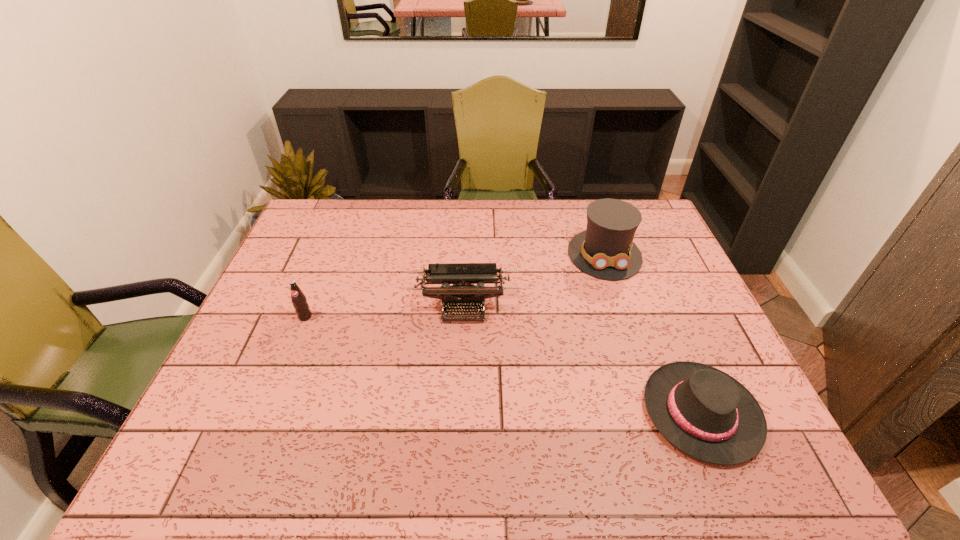
Find the location of `the farther dress hat`. the farther dress hat is located at coordinates (605, 250).

Where is `the tallest object`? This screenshot has width=960, height=540. the tallest object is located at coordinates (605, 250).

At what (x,y) coordinates should I click in order to perform the action: click on the leftmost object. Please return your answer as a coordinate pair (x, y). The height and width of the screenshot is (540, 960). Looking at the image, I should click on click(299, 300).

The width and height of the screenshot is (960, 540). Identify the location of pop. [299, 300].

At what (x,y) coordinates should I click in order to perform the action: click on typewriter. Please return your answer as a coordinate pair (x, y). This screenshot has width=960, height=540. Looking at the image, I should click on (463, 276).

At what (x,y) coordinates should I click in order to perform the action: click on the nearest object. Please return your answer as a coordinate pair (x, y). Looking at the image, I should click on (704, 412).

You are a GUI agent. You are given a task and a screenshot of the screen. Output one action in this format:
    pyautogui.click(x=<x>, y=<y>)
    Task: Click on the shortest object
    
    Given the screenshot: What is the action you would take?
    pyautogui.click(x=704, y=412)

You are a GUI agent. You are given a task and a screenshot of the screen. Output one action in this format:
    pyautogui.click(x=<x>, y=<y>)
    Task: Click on the free point located 0.220m with goggles on the front of the farther dress hat
    This screenshot has height=540, width=960.
    Given the screenshot: What is the action you would take?
    pos(633,338)

At what (x,y) coordinates should I click in order to perform the action: click on vacant space situated 0.310m on the front label of the pop. Please return your answer as a coordinate pair (x, y). The height and width of the screenshot is (540, 960). Looking at the image, I should click on (262, 425).

The height and width of the screenshot is (540, 960). In order to click on free space located on the typing side of the typewriter in this screenshot , I will do `click(462, 353)`.